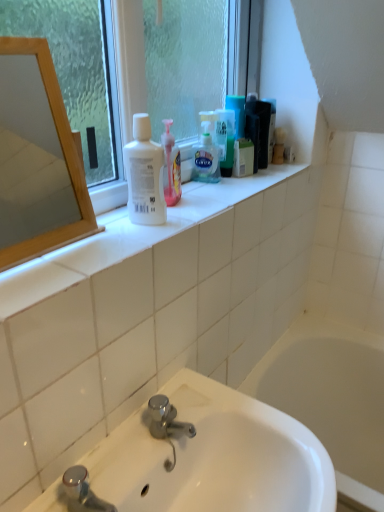
Question: Considering the relative sizes of white matte bottle at upper center and white glossy sink at lower center in the image provided, is white matte bottle at upper center wider than white glossy sink at lower center?

Choices:
 (A) yes
 (B) no

Answer: (B)

Question: From a real-world perspective, is white matte bottle at upper center under white glossy sink at lower center?

Choices:
 (A) no
 (B) yes

Answer: (A)

Question: Does white matte bottle at upper center appear on the left side of white glossy sink at lower center?

Choices:
 (A) yes
 (B) no

Answer: (A)

Question: Does white matte bottle at upper center have a smaller size compared to white glossy sink at lower center?

Choices:
 (A) no
 (B) yes

Answer: (B)

Question: Is white matte bottle at upper center behind white glossy sink at lower center?

Choices:
 (A) no
 (B) yes

Answer: (B)

Question: Does white matte bottle at upper center have a greater height compared to white glossy sink at lower center?

Choices:
 (A) no
 (B) yes

Answer: (A)

Question: Can you confirm if green matte box at upper center is smaller than wooden mirror at left?

Choices:
 (A) yes
 (B) no

Answer: (A)

Question: Considering the relative sizes of green matte box at upper center and wooden mirror at left in the image provided, is green matte box at upper center bigger than wooden mirror at left?

Choices:
 (A) no
 (B) yes

Answer: (A)

Question: Is green matte box at upper center to the left of wooden mirror at left from the viewer's perspective?

Choices:
 (A) yes
 (B) no

Answer: (B)

Question: Can you confirm if green matte box at upper center is thinner than wooden mirror at left?

Choices:
 (A) no
 (B) yes

Answer: (B)

Question: Is green matte box at upper center positioned beyond the bounds of wooden mirror at left?

Choices:
 (A) no
 (B) yes

Answer: (B)

Question: Considering the relative sizes of green matte box at upper center and wooden mirror at left in the image provided, is green matte box at upper center taller than wooden mirror at left?

Choices:
 (A) yes
 (B) no

Answer: (B)

Question: Is white glossy sink at lower center located outside clear glass window at upper center?

Choices:
 (A) no
 (B) yes

Answer: (B)